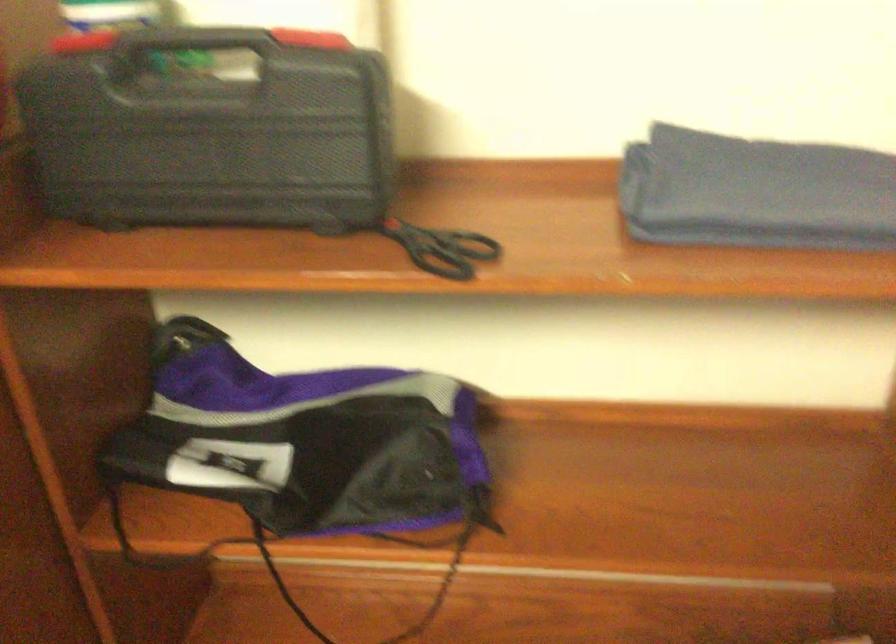
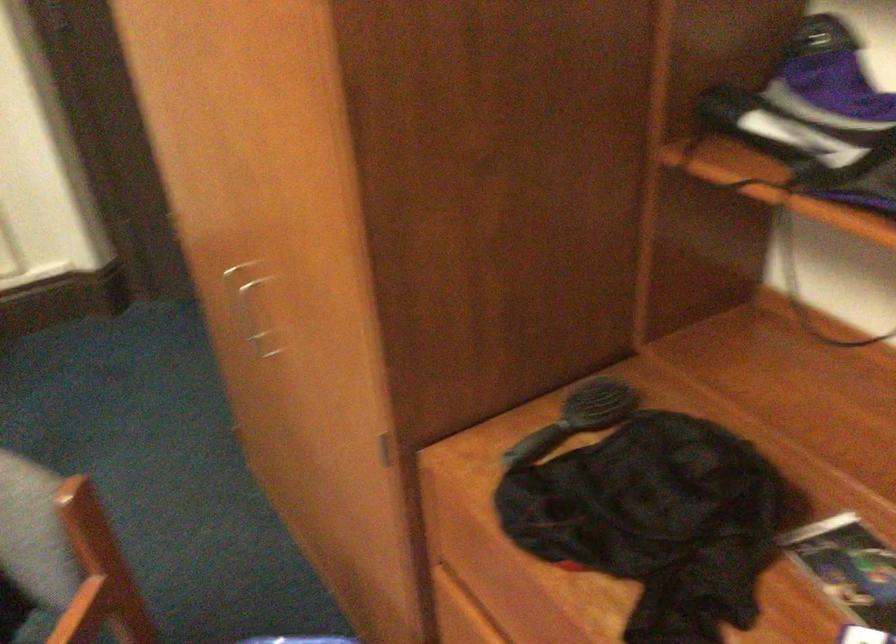
Consider the image. First-person continuous shooting, in which direction is the camera rotating?

The camera's rotation is toward left-down.